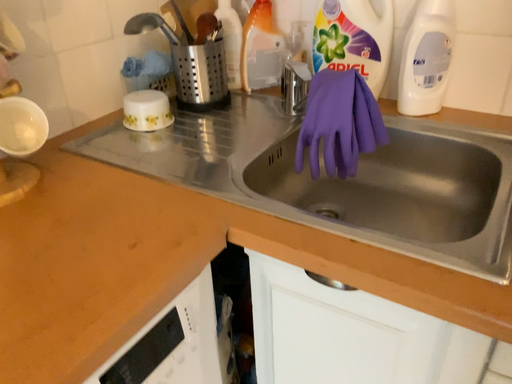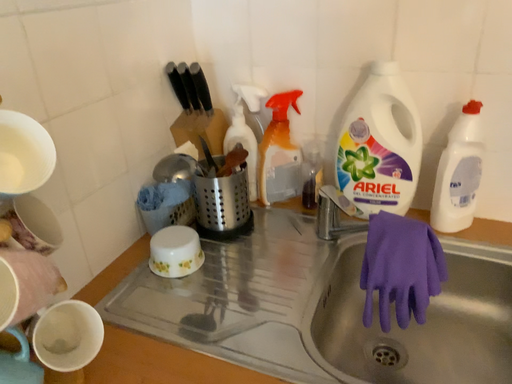
Question: Which way did the camera rotate in the video?

Choices:
 (A) rotated right
 (B) rotated left

Answer: (A)